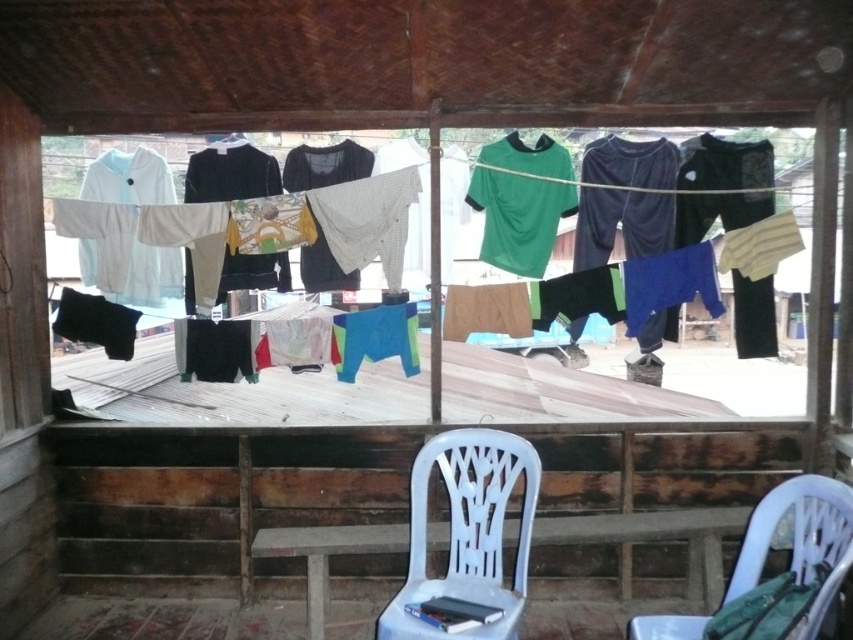
Question: Which point appears closest to the camera in this image?

Choices:
 (A) (795, 570)
 (B) (56, 173)

Answer: (A)

Question: Is white plastic chair at lower center above white plastic chair at lower right?

Choices:
 (A) no
 (B) yes

Answer: (B)

Question: In this image, where is white plastic chair at lower center located relative to white plastic chair at lower right?

Choices:
 (A) right
 (B) left

Answer: (B)

Question: Is white plastic chair at lower center below white plastic chair at lower right?

Choices:
 (A) no
 (B) yes

Answer: (A)

Question: Among these objects, which one is nearest to the camera?

Choices:
 (A) white plastic chair at lower right
 (B) white fabric at center
 (C) white plastic chair at lower center

Answer: (A)

Question: Considering the real-world distances, which object is farthest from the white fabric at center?

Choices:
 (A) white plastic chair at lower right
 (B) white plastic chair at lower center

Answer: (A)